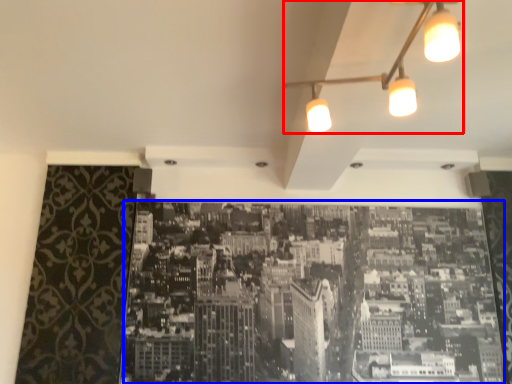
Question: Among these objects, which one is farthest to the camera, lamp (highlighted by a red box) or hotel (highlighted by a blue box)?

Choices:
 (A) lamp
 (B) hotel

Answer: (B)